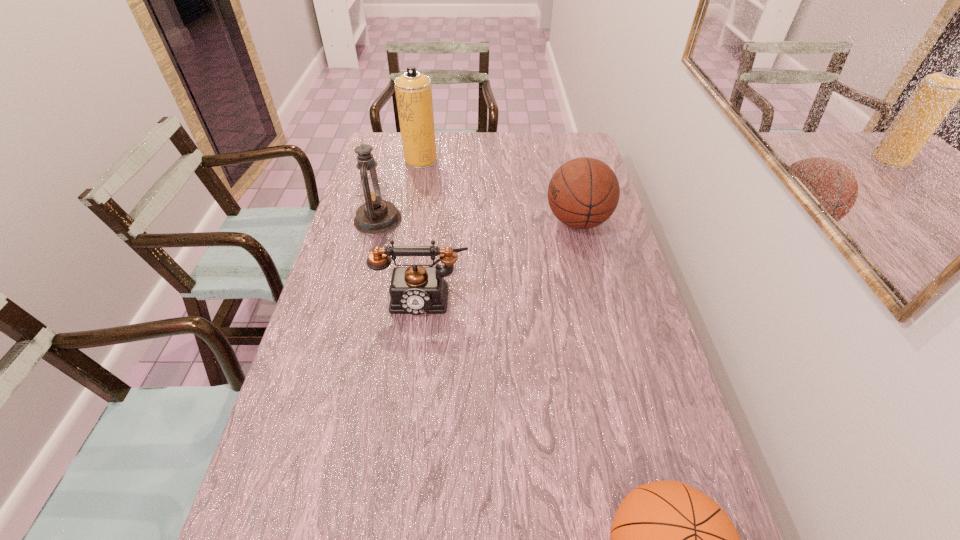
Locate an element on the screen. aerosol can is located at coordinates click(413, 90).

I want to click on the second tallest object, so click(x=376, y=216).

This screenshot has width=960, height=540. What are the coordinates of `the farther basketball` in the screenshot? It's located at (584, 192).

The image size is (960, 540). Identify the location of the second nearest object. (416, 290).

You are a GUI agent. You are given a task and a screenshot of the screen. Output one action in this format:
    pyautogui.click(x=<x>, y=<y>)
    Task: Click on the vacant space located on the right of the farthest object
    The width and height of the screenshot is (960, 540).
    Given the screenshot: What is the action you would take?
    pyautogui.click(x=449, y=160)

I want to click on free region located on the right of the oil lamp, so click(455, 220).

Find the location of a particular element. vacant space located 0.160m on the side with brand label of the farther basketball is located at coordinates (496, 221).

Identify the location of vacant area situated on the side with brand label of the farther basketball. The width and height of the screenshot is (960, 540). (485, 221).

At what (x,y) coordinates should I click in order to perform the action: click on free space located 0.270m on the side with brand label of the farther basketball. Please return your answer as a coordinate pair (x, y). The height and width of the screenshot is (540, 960). Looking at the image, I should click on (464, 221).

The width and height of the screenshot is (960, 540). In order to click on free space located 0.250m on the front of the fourth farthest object at the rotary dial in this screenshot , I will do `click(410, 402)`.